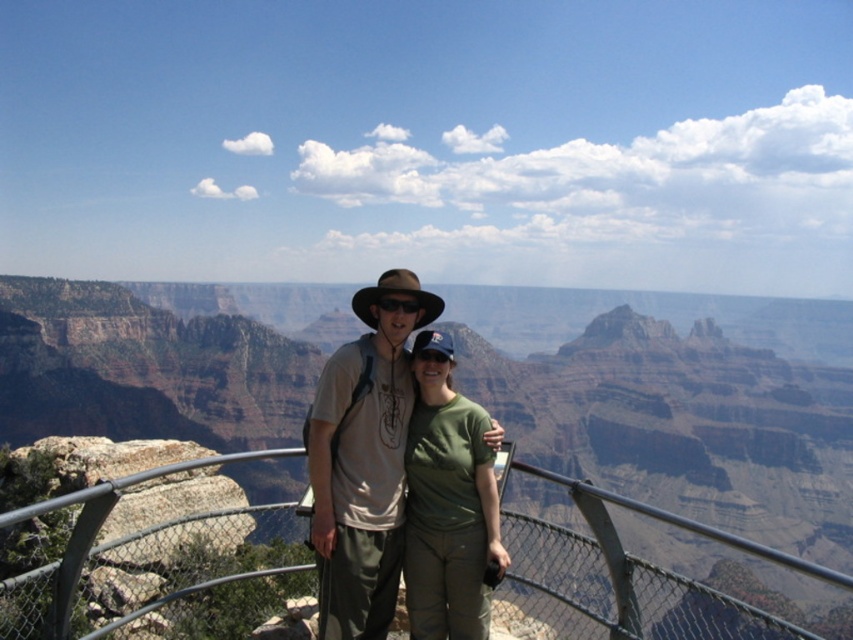
Consider the image. You are a photographer trying to capture the perfect shot of the Grand Canyon. You want to position your camera so that the matte khaki pants at center are exactly at the center of the image. Given the current coordinates of the pants, what adjustment should you make to the camera position?

The matte khaki pants at center are currently located at coordinates point (364, 458). To center them, move the camera slightly to the left and upward so that the pants are positioned at the center point of the image.

You are a photographer trying to capture a clear shot of the brown fabric cowboy hat at center without the matte khaki pants at center blocking it. Based on their positions, can you adjust your angle to achieve this?

The matte khaki pants at center is in front of the brown fabric cowboy hat at center, so you would need to move your camera position to the side or behind the pants to avoid blocking the view of the hat.